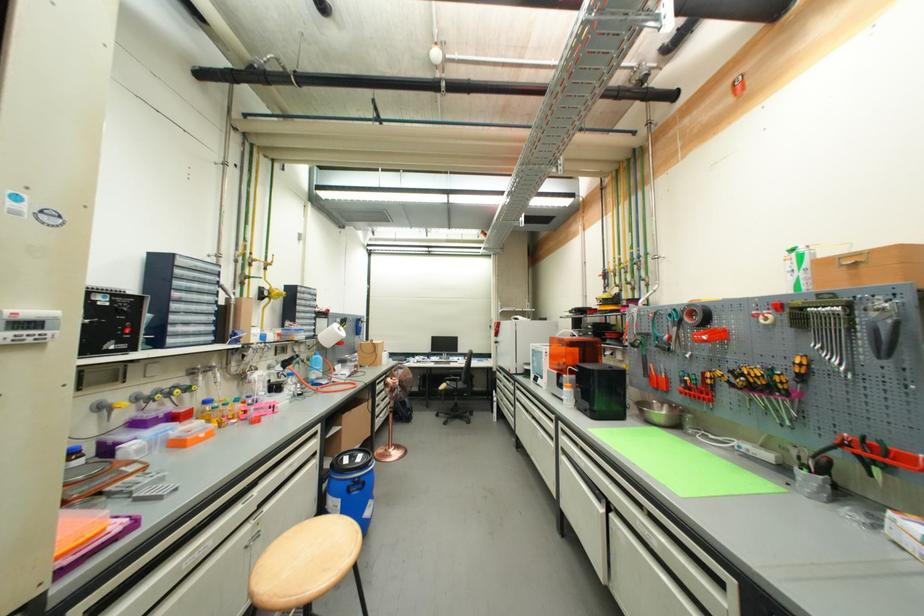
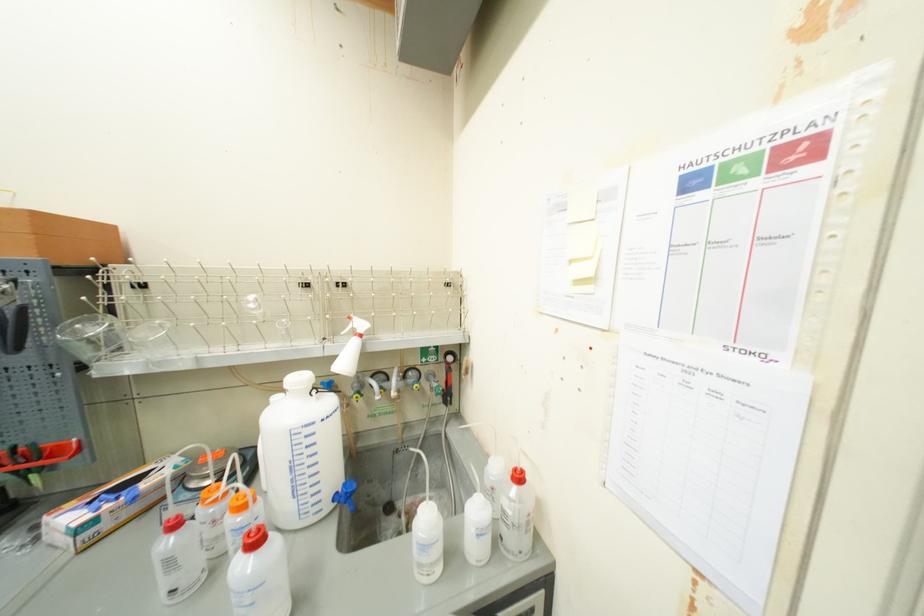
Where in the second image is the point corresponding to the point at 862,440 from the first image?

(13, 453)